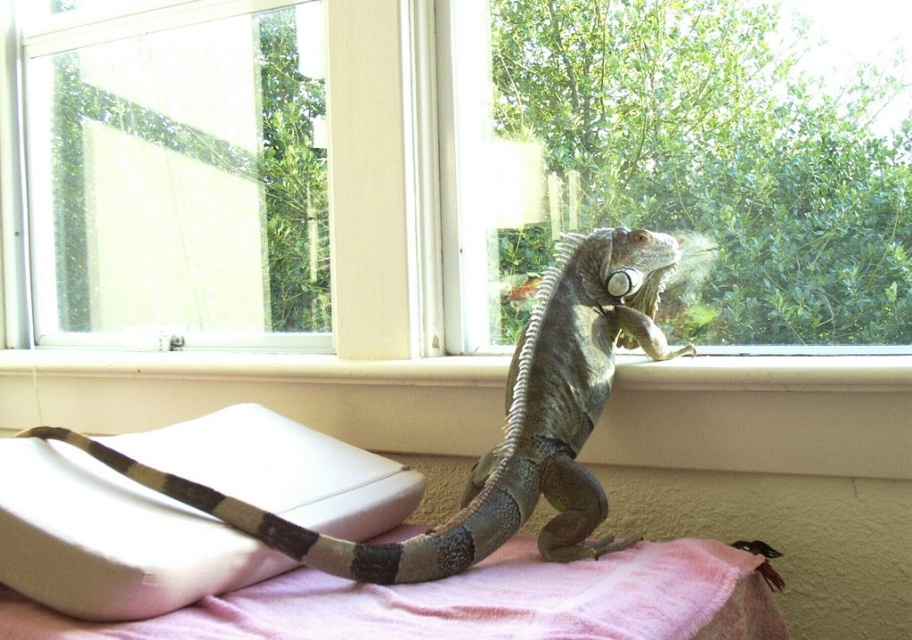
You are a small lizard that wants to move from the smooth white window sill at center to the pink fabric bed at lower center. Which direction should you go to reach it?

The pink fabric bed at lower center is located below the smooth white window sill at center, so the lizard should move downward to reach it.

You are placing a small plant pot that is 0.1 meters in diameter. Where should you place it so that it doesn not block the view of the white foam pillow at lower left from the window?

The white foam pillow at lower left is located at point [111,538]. To avoid blocking its view from the window, place the plant pot away from that coordinate, ensuring it doesn not obstruct the line of sight between the pillow and the window.

You are a pet owner who wants to ensure the safety of your green scaly lizard at upper center. Since the lizard is on the windowsill above the pink fabric bed at lower center, is there a risk of it falling onto the bed? Please explain based on their positions.

The green scaly lizard at upper center is positioned over the pink fabric bed at lower center, so there is a risk of it falling onto the bed if it loses its balance.